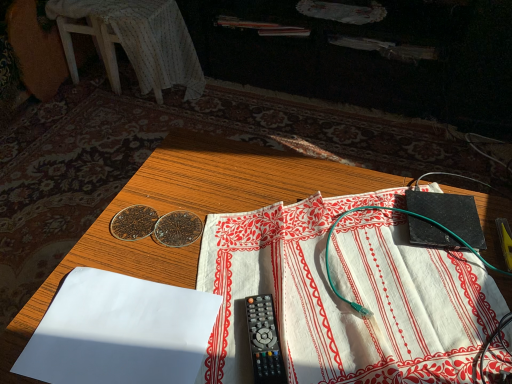
Image resolution: width=512 pixels, height=384 pixels. What are the coordinates of `vacant space that is in between black plastic remote control at center and white paper at lower left, the 2th sheet from the right` in the screenshot? It's located at (214, 323).